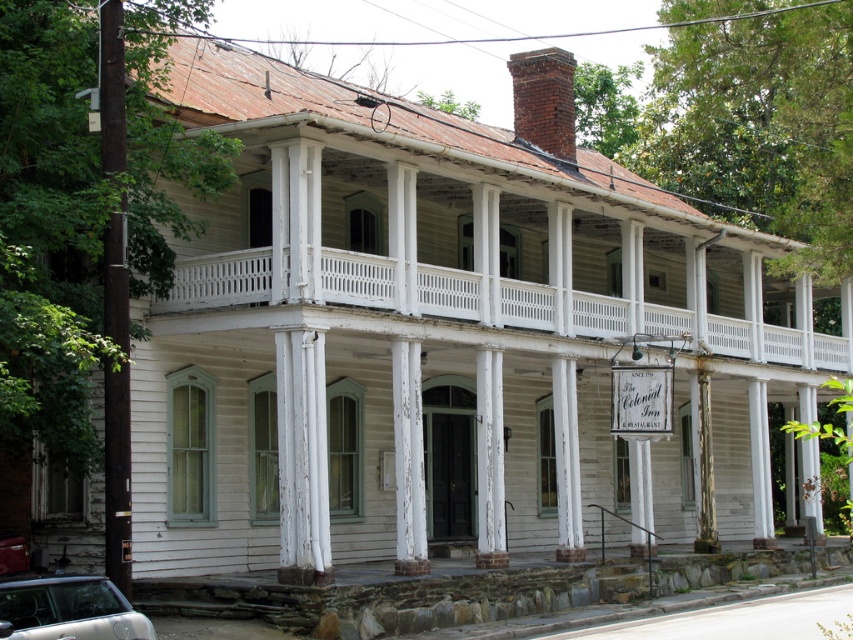
Is point (531, 125) positioned before point (490, 566)?

No.

This screenshot has width=853, height=640. Identify the location of brick chimney at upper center. (544, 99).

Is point (527, 60) closer to viewer compared to point (491, 429)?

No, (527, 60) is behind (491, 429).

Where is `brick chimney at upper center`? The image size is (853, 640). brick chimney at upper center is located at coordinates 544,99.

Image resolution: width=853 pixels, height=640 pixels. What do you see at coordinates (489, 460) in the screenshot?
I see `white weathered wood column at center` at bounding box center [489, 460].

Which is more to the left, white weathered wood column at center or white weathered wood at center?

white weathered wood column at center

Does point (479, 564) lie behind point (558, 438)?

No, it is in front of (558, 438).

Locate an element on the screen. The height and width of the screenshot is (640, 853). white weathered wood column at center is located at coordinates (489, 460).

What do you see at coordinates (68, 611) in the screenshot? The height and width of the screenshot is (640, 853). I see `silver metallic car at lower left` at bounding box center [68, 611].

Based on the photo, between silver metallic car at lower left and white weathered wood at center, which one is positioned lower?

Positioned lower is silver metallic car at lower left.

Find the location of a particular element. This screenshot has height=640, width=853. silver metallic car at lower left is located at coordinates (68, 611).